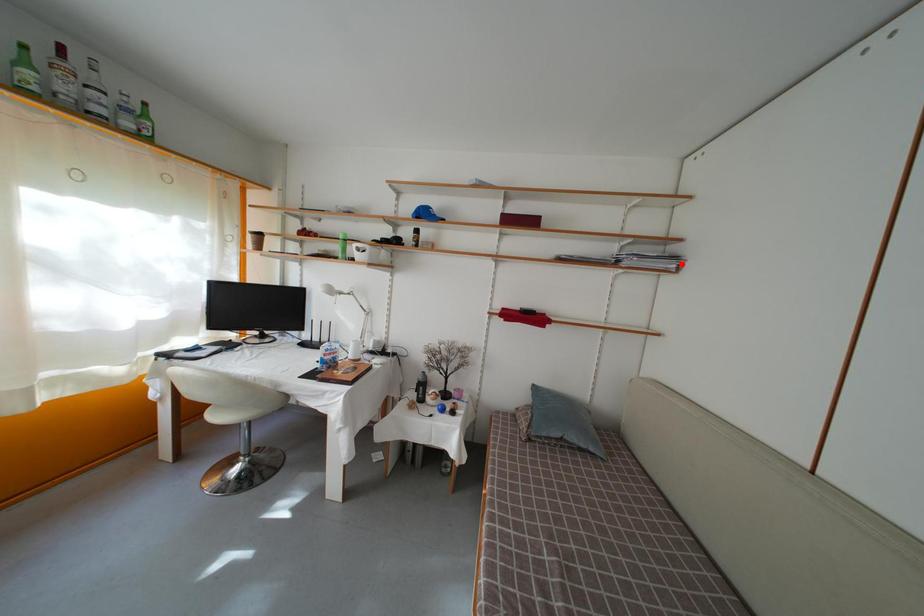
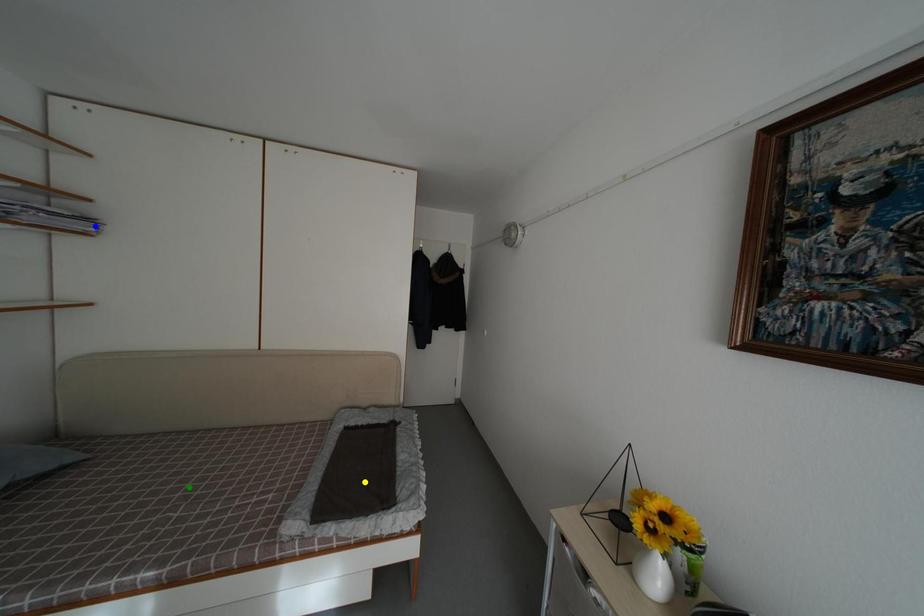
Question: I am providing you with two images of the same scene from different viewpoints. A red point is marked on the first image. You are given multiple points on the second image. Which mark in image 2 goes with the point in image 1?

Choices:
 (A) blue point
 (B) green point
 (C) yellow point

Answer: (A)